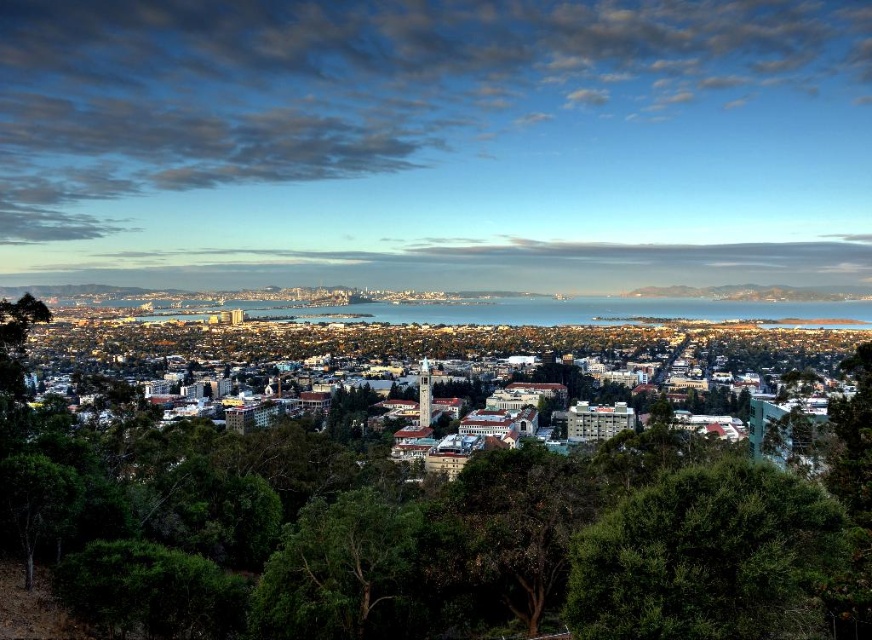
You are standing in the city park and see the blue sky at upper center and the dark green leafy tree at lower right. Which object is located to the left side of the other?

The blue sky at upper center is to the left of dark green leafy tree at lower right.

You are a drone operator trying to capture a photo of the cityscape. Your drone is currently at the position of the blue sky at upper center. To avoid obstacles, you need to move it 0.1 units north. What will be the new coordinates?

The blue sky at upper center is at point [436,141]. Moving 0.1 units north would adjust the y coordinate. Since north corresponds to the positive y direction, the new coordinates would be [523,141].